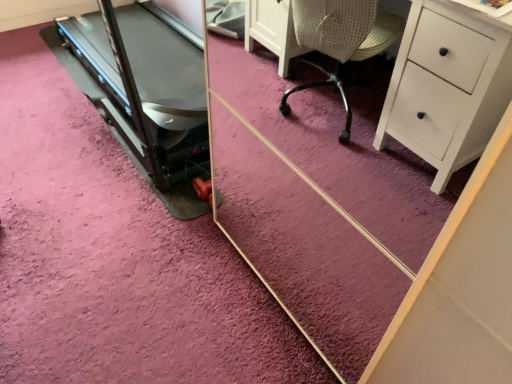
Where is `metallic gray treadmill at left`? This screenshot has height=384, width=512. metallic gray treadmill at left is located at coordinates (143, 96).

This screenshot has width=512, height=384. Describe the element at coordinates (143, 96) in the screenshot. I see `metallic gray treadmill at left` at that location.

Locate an element on the screen. The width and height of the screenshot is (512, 384). metallic gray treadmill at left is located at coordinates (143, 96).